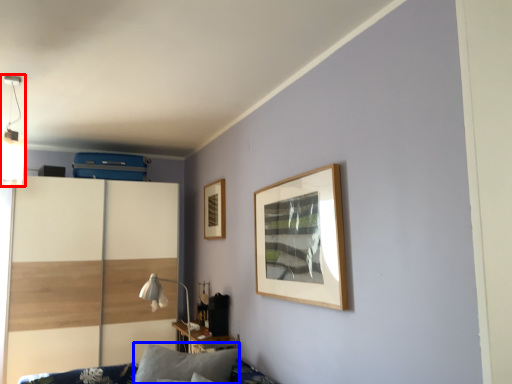
Question: Which of the following is the closest to the observer, light fixture (highlighted by a red box) or pillow (highlighted by a blue box)?

Choices:
 (A) light fixture
 (B) pillow

Answer: (B)